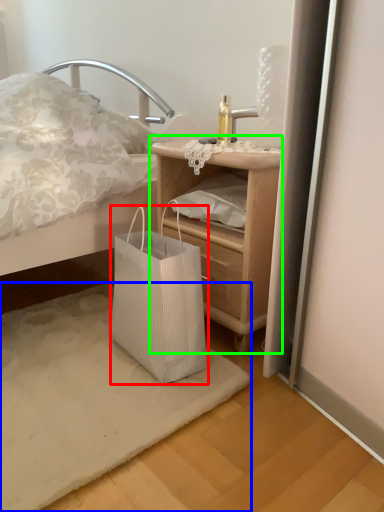
Question: Which object is positioned farthest from bag (highlighted by a red box)? Select from mat (highlighted by a blue box) and nightstand (highlighted by a green box).

Choices:
 (A) mat
 (B) nightstand

Answer: (B)